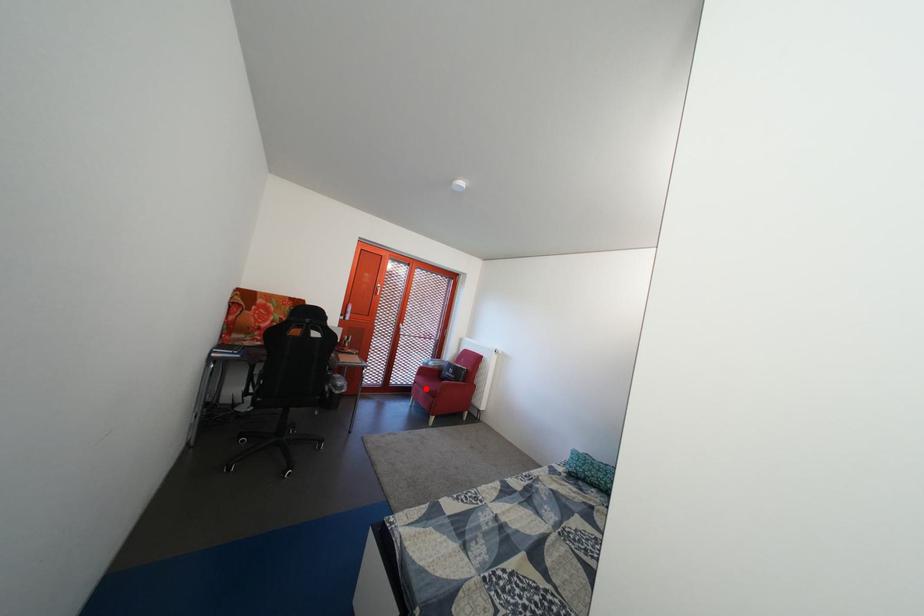
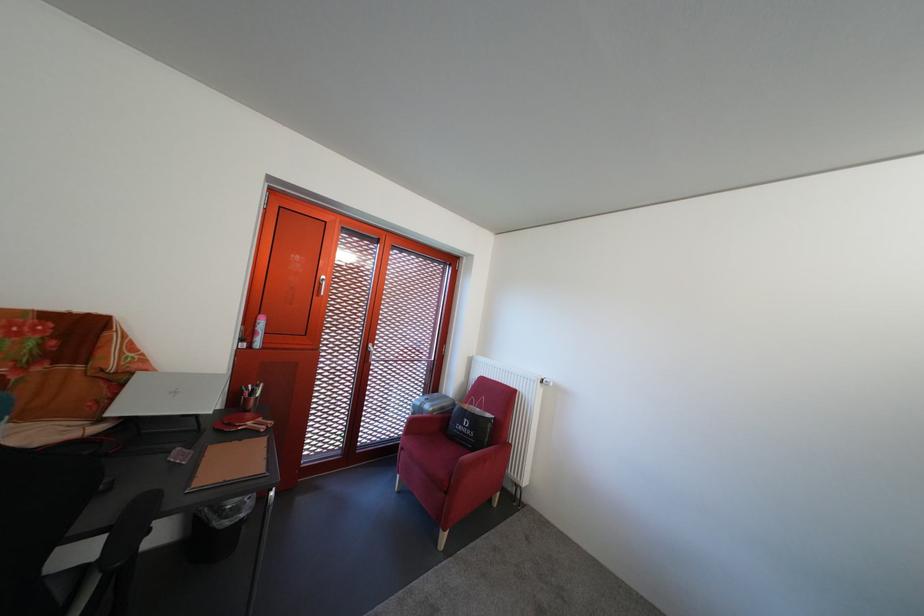
The point at the highlighted location is marked in the first image. Where is the corresponding point in the second image?

(412, 456)